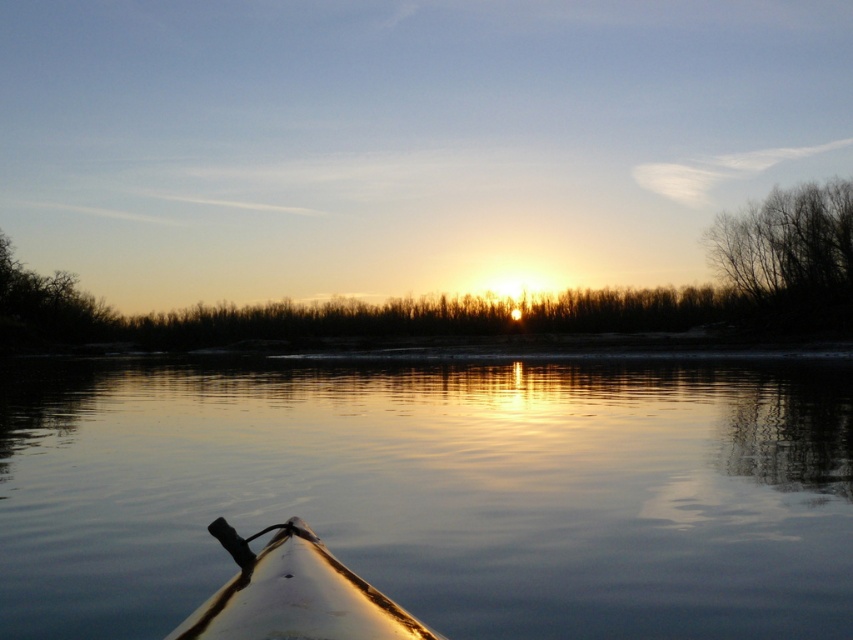
Who is shorter, white glossy kayak at lower center or bare branches at upper right?

With less height is white glossy kayak at lower center.

How much distance is there between white glossy kayak at lower center and bare branches at upper right?

white glossy kayak at lower center is 76.56 meters from bare branches at upper right.

The width and height of the screenshot is (853, 640). Identify the location of white glossy kayak at lower center. (294, 595).

Does point (631, 380) come in front of point (254, 557)?

No.

Is point (560, 385) positioned before point (183, 632)?

No, (560, 385) is behind (183, 632).

This screenshot has width=853, height=640. Identify the location of glossy water at center. click(434, 492).

Between glossy water at center and bare branches at upper right, which one appears on the right side from the viewer's perspective?

From the viewer's perspective, bare branches at upper right appears more on the right side.

Is glossy water at center to the right of bare branches at upper right from the viewer's perspective?

Incorrect, glossy water at center is not on the right side of bare branches at upper right.

Is point (361, 476) behind point (761, 308)?

No, (361, 476) is in front of (761, 308).

Identify the location of glossy water at center. (434, 492).